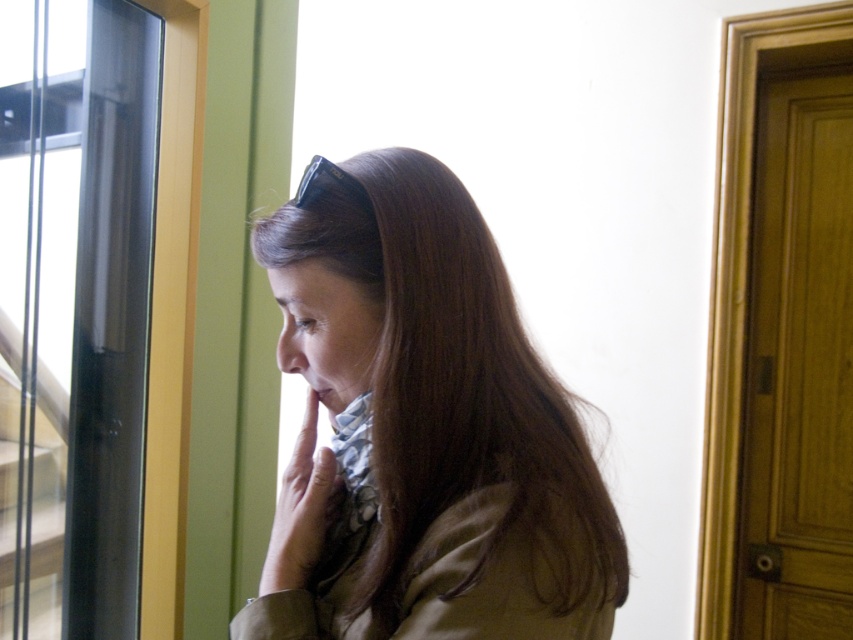
Question: Which point is farther to the camera?

Choices:
 (A) transparent glass door at left
 (B) matte skin at center
 (C) transparent glass door at right

Answer: (C)

Question: Which point is farther to the camera?

Choices:
 (A) matte black hand at center
 (B) brown matte hair at center
 (C) transparent glass door at right

Answer: (C)

Question: Is transparent glass door at left positioned before matte skin at center?

Choices:
 (A) no
 (B) yes

Answer: (A)

Question: Among these objects, which one is farthest from the camera?

Choices:
 (A) matte black hand at center
 (B) matte skin at center

Answer: (A)

Question: Does transparent glass door at left appear over transparent glass door at right?

Choices:
 (A) yes
 (B) no

Answer: (A)

Question: Can you confirm if transparent glass door at left is positioned below matte black hand at center?

Choices:
 (A) yes
 (B) no

Answer: (B)